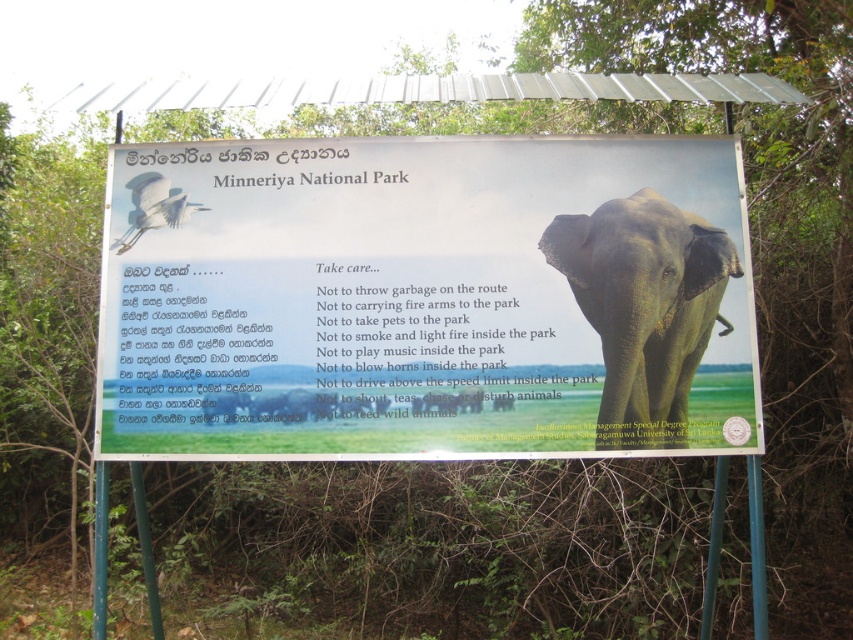
You are a wildlife photographer planning to take a photo of the gray matte elephant at center and the white glossy bird at upper left in the background. Since you want both subjects to be clearly visible in your shot, which one should you focus on first to ensure proper focus?

You should focus on the gray matte elephant at center first because it is wider than the white glossy bird at upper left, so ensuring its focus will help both subjects be clearer in the photo.

You are standing in front of the matte white signboard at center at Minneriya National Park. If you want to locate the exact position of the signboard, what are its coordinates?

The matte white signboard at center is located at coordinates point (430,300).

You are standing in front of the signboard at Minneriya National Park. You see a point marked at coordinates point (x=430, y=300). Where is this point located relative to the signboard?

The point (x=430, y=300) is on the matte white signboard at center, so it is located on the signboard itself.